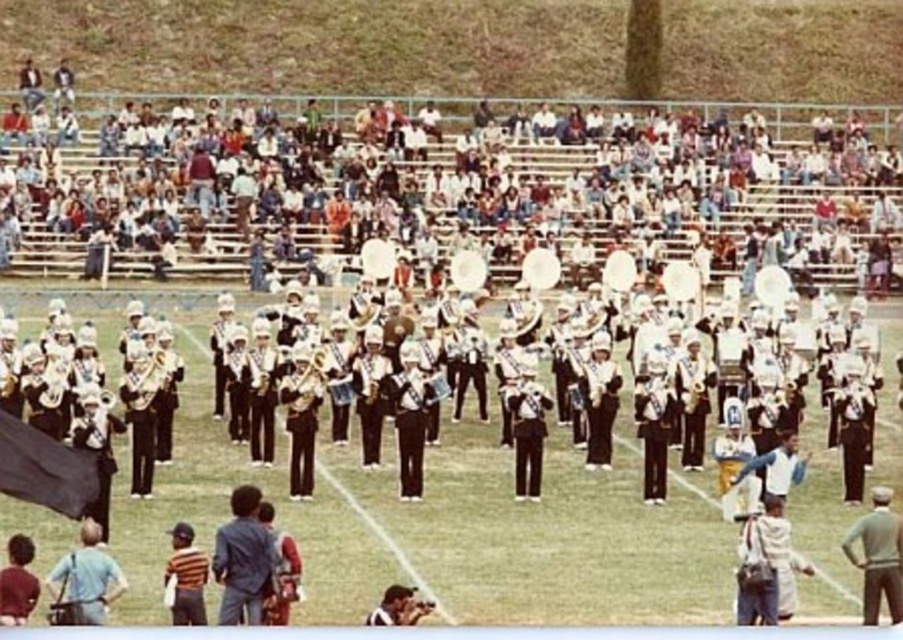
You are standing at the position of the camera holder and want to throw a water bottle to your friend who is at point (193, 554). There is an obstacle at point (96, 589). Will the obstacle block your throw?

The obstacle at point (96, 589) is closer to you than your friend at point (193, 554), so the obstacle will block your throw.

You are a photographer at the marching band event. You want to take a photo of both the gray sweater at lower right and the light blue shirt at lower left. Which one should you focus on first to ensure it appears sharp in the photo?

You should focus on the gray sweater at lower right first because it is closer to you than the light blue shirt at lower left, so focusing on the closer object first will help ensure both are in focus when using depth of field properly.

You are a photographer standing at the edge of the field. You want to take a photo of the band members while also including both the light blue shirt at lower left and the striped shirt at lower left in the frame. Which of the two shirts should you focus on first to ensure both are in focus?

The light blue shirt at lower left is closer to the viewer than the striped shirt at lower left. To ensure both are in focus, focus on the light blue shirt at lower left first since it is closer, and the striped shirt at lower left will be within the depth of field if the focus is set appropriately.